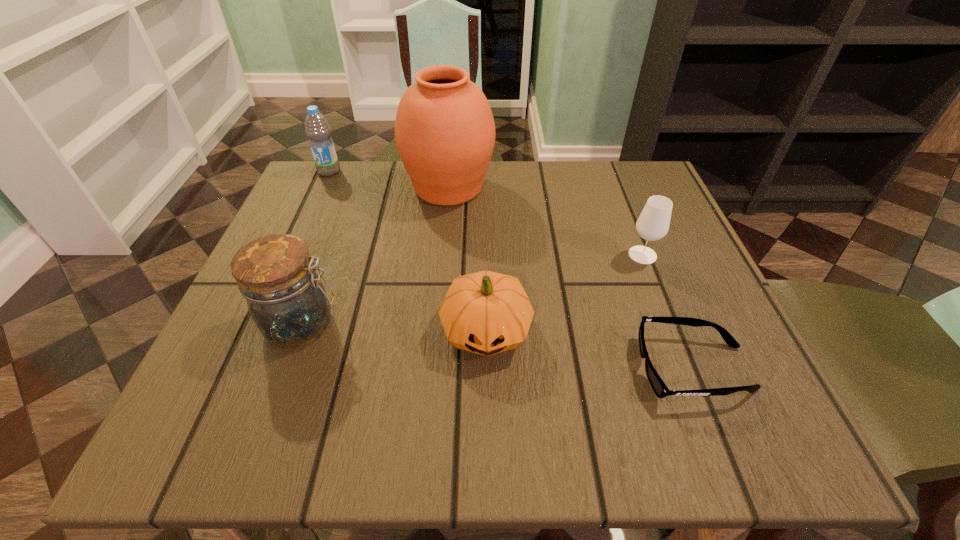
Where is `sunglasses that is at the right edge`? The image size is (960, 540). sunglasses that is at the right edge is located at coordinates (660, 389).

This screenshot has height=540, width=960. Identify the location of object located in the far left corner section of the desktop. (317, 129).

Find the location of `object that is positioned at the near right corner`. object that is positioned at the near right corner is located at coordinates (660, 389).

I want to click on free space at the far edge of the desktop, so click(x=585, y=205).

You are a GUI agent. You are given a task and a screenshot of the screen. Output one action in this format:
    pyautogui.click(x=<x>, y=<y>)
    Task: Click on the vacant space at the near edge
    
    Given the screenshot: What is the action you would take?
    pyautogui.click(x=383, y=415)

At what (x,y) coordinates should I click in order to perform the action: click on vacant region at the left edge. Please return your answer as a coordinate pair (x, y). Image resolution: width=960 pixels, height=540 pixels. Looking at the image, I should click on (248, 334).

Locate an element on the screen. The image size is (960, 540). vacant space at the right edge is located at coordinates (740, 349).

I want to click on vacant space at the far left corner of the desktop, so click(x=312, y=212).

At what (x,y) coordinates should I click in order to perform the action: click on vacant space at the far right corner of the desktop. Please return your answer as a coordinate pair (x, y). This screenshot has height=540, width=960. Looking at the image, I should click on (598, 176).

Find the location of a particular element. unoccupied position between the gourd and the jar is located at coordinates (395, 327).